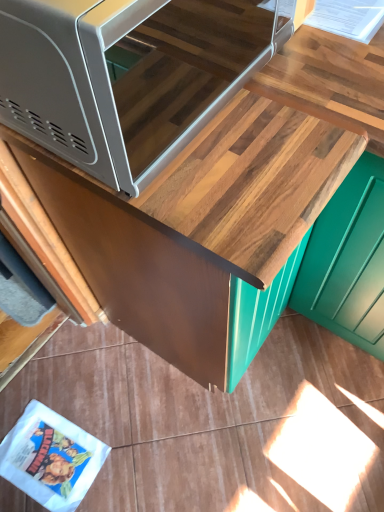
At what (x,y) coordinates should I click in order to perform the action: click on free region under matte gray microwave at upper left (from a real-world perspective). Please return your answer as a coordinate pair (x, y). The width and height of the screenshot is (384, 512). Looking at the image, I should click on (161, 99).